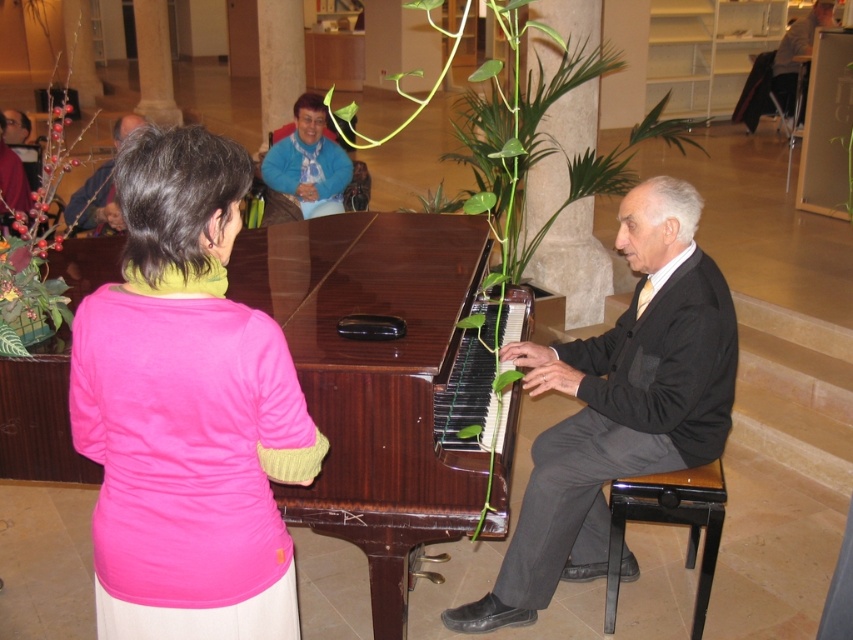
Based on the photo, you are standing in the indoor area and want to see both the silvery metallic plant at left and the blue soft scarf at upper center. Which object is closer to you?

The silvery metallic plant at left is closer to you because it is in front of the blue soft scarf at upper center.

Looking at this image, you are a stagehand setting up for a performance. You need to place a 1.2m tall amplifier behind the piano. Which piano, the mahogany wood piano at center or the matte black piano at center, should you choose to ensure the amplifier fits without blocking the performer?

The mahogany wood piano at center is taller than the matte black piano at center. To ensure the amplifier fits without blocking the performer, place it behind the matte black piano at center since it is shorter, allowing the amplifier to be positioned behind without obstruction.

You are a photographer setting up for a photoshoot in this indoor area. You need to position a large camera tripod between the dark gray suit at right and the black glossy stool at lower right. Based on their positions, which object should the tripod be placed closer to?

The dark gray suit at right is to the left of the black glossy stool at lower right, so the tripod should be placed closer to the black glossy stool at lower right since it is positioned further to the right.